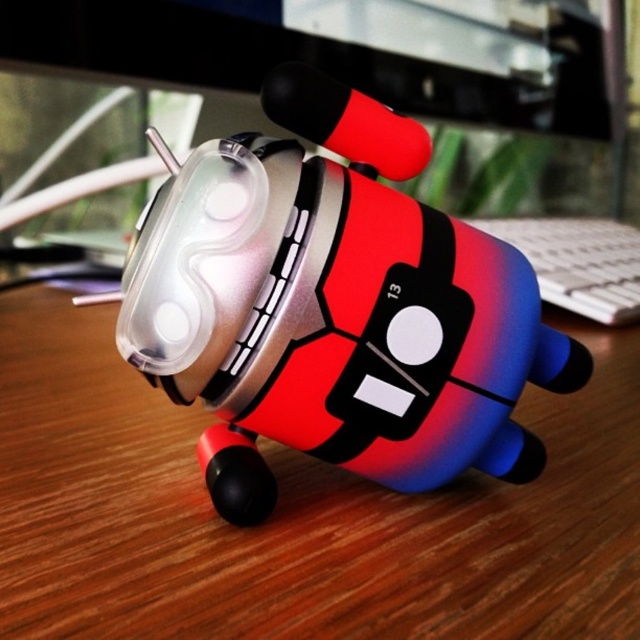
Who is positioned more to the left, wooden desk at center or white plastic keyboard at center?

wooden desk at center

Does wooden desk at center appear under white plastic keyboard at center?

Indeed, wooden desk at center is positioned under white plastic keyboard at center.

Which is in front, point (566, 483) or point (568, 276)?

Point (566, 483) is in front.

You are a GUI agent. You are given a task and a screenshot of the screen. Output one action in this format:
    pyautogui.click(x=<x>, y=<y>)
    Task: Click on the wooden desk at center
    
    Given the screenshot: What is the action you would take?
    pyautogui.click(x=296, y=509)

Does wooden desk at center come behind gradient plastic toy at center?

That is False.

Does wooden desk at center appear on the right side of gradient plastic toy at center?

Incorrect, wooden desk at center is not on the right side of gradient plastic toy at center.

In order to click on wooden desk at center in this screenshot , I will do `click(296, 509)`.

Is gradient plastic toy at center to the right of white plastic keyboard at center from the viewer's perspective?

No, gradient plastic toy at center is not to the right of white plastic keyboard at center.

Looking at this image, can you confirm if gradient plastic toy at center is wider than white plastic keyboard at center?

Yes.

This screenshot has width=640, height=640. What are the coordinates of `gradient plastic toy at center` in the screenshot? It's located at (333, 307).